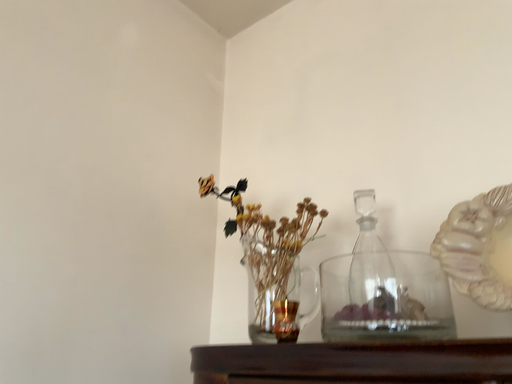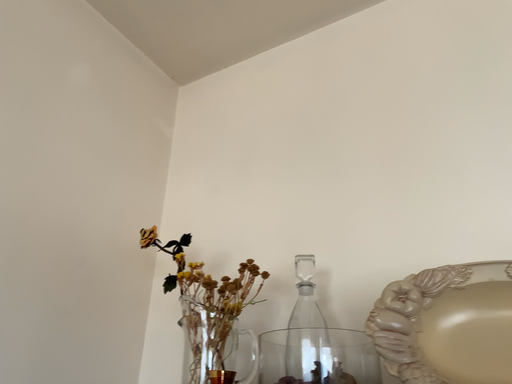
Question: How did the camera likely rotate when shooting the video?

Choices:
 (A) rotated right
 (B) rotated left

Answer: (A)